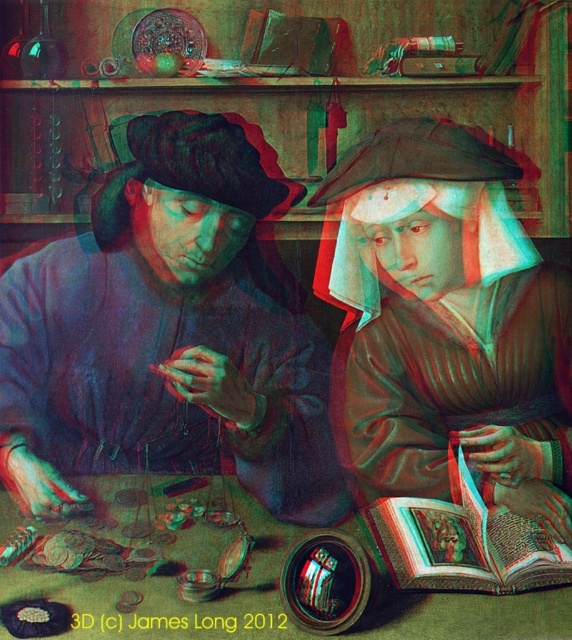
Question: Can you confirm if matte brown coat at center-left is bigger than brown leather book at center?

Choices:
 (A) yes
 (B) no

Answer: (A)

Question: Is matte brown robe at center thinner than wooden table at center?

Choices:
 (A) no
 (B) yes

Answer: (B)

Question: Considering the real-world distances, which object is closest to the matte brown coat at center-left?

Choices:
 (A) wooden table at center
 (B) matte brown robe at center

Answer: (B)

Question: Which point is closer to the camera?

Choices:
 (A) (545, 532)
 (B) (168, 419)
 (C) (144, 513)
 (D) (484, 387)

Answer: (A)

Question: Estimate the real-world distances between objects in this image. Which object is closer to the brown leather book at center?

Choices:
 (A) matte brown robe at center
 (B) wooden table at center
 (C) matte brown coat at center-left

Answer: (B)

Question: Can you confirm if matte brown coat at center-left is positioned to the right of wooden table at center?

Choices:
 (A) yes
 (B) no

Answer: (B)